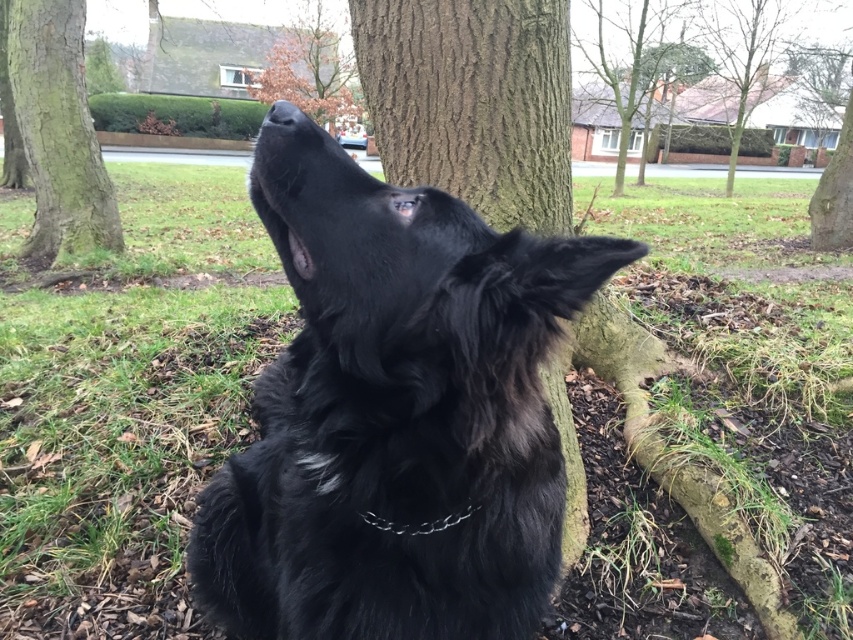
You are a squirrel trying to climb from the smooth brown bark at center to the brown textured tree at upper center. Which part of the tree would be easier to grip?

The brown textured tree at upper center would be easier to grip because the smooth brown bark at center is to the left of it, but the texture provides better traction for climbing.

You are standing at the camera position and want to throw a ball to a point exactly halfway between you and the point labeled as point (415, 134). How far will the ball travel in feet?

The distance between you and point (415, 134) is 8.73 feet. Half of that distance is 4.365 feet, so the ball will travel 4.365 feet.